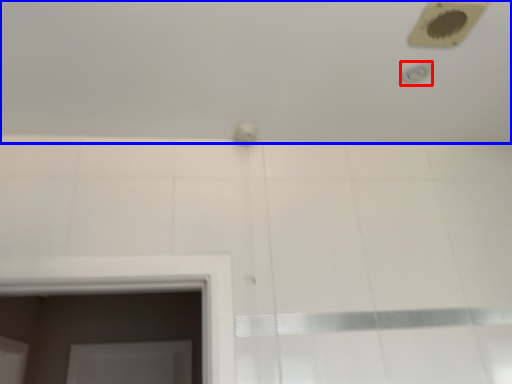
Question: Among these objects, which one is farthest to the camera, shower (highlighted by a red box) or bath (highlighted by a blue box)?

Choices:
 (A) shower
 (B) bath

Answer: (A)